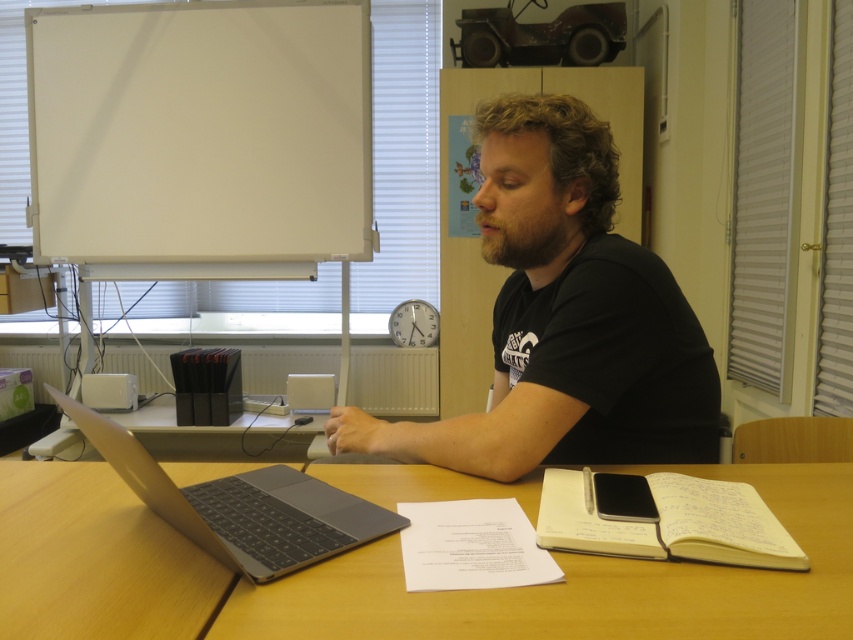
You are trying to place a new object on the wooden table at center. The object is as wide as the black matte shirt at center. Will it fit on the table?

The wooden table at center is wider than the black matte shirt at center, so the object will fit on the table.

You are standing in front of the desk and want to place a small object on the surface. Considering the black matte shirt at center and the white matte board at upper left, which one is shorter and thus safer to place the object near to avoid obstruction?

The black matte shirt at center is shorter than the white matte board at upper left, so placing the object near the black matte shirt at center would be safer to avoid obstruction.

You are standing in front of the desk and want to place a small object on the surface. Which object, the black matte shirt at center or the white matte board at upper left, is closer to the edge of the desk?

The white matte board at upper left is closer to the edge of the desk because it is positioned at the upper left corner, while the black matte shirt at center is located in the middle of the desk.